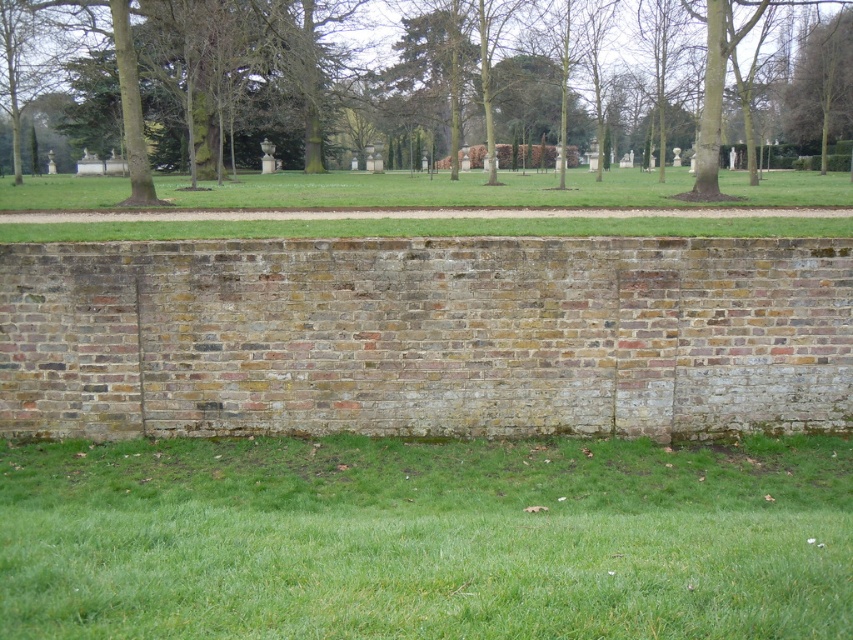
You are standing in the park and want to walk to the green grass at lower center. Based on the coordinates provided, in which direction should you move relative to your current position?

The green grass at lower center is located at coordinates approximately 0.842 on the x axis and 0.499 on the y axis. Since the lower center position typically corresponds to the bottom middle area of the image, you should move downward and slightly to the right from your current position to reach it.

You are standing at the point marked by the coordinates point [425,538] in the park. Based on the scene description, what type of terrain are you currently standing on?

The point [425,538] is on green grass at lower center, so you are standing on green grass.

You are a gardener who wants to plant a new shrub that requires at least 2 meters of space. You see the green grass at lower center and the green leafy tree at upper right. Which area would be suitable for planting the shrub?

The green leafy tree at upper right has a greater height than the green grass at lower center. Since the shrub requires 2 meters of space, the area near the green leafy tree at upper right would be more suitable as it likely has enough vertical space for the shrub to grow.